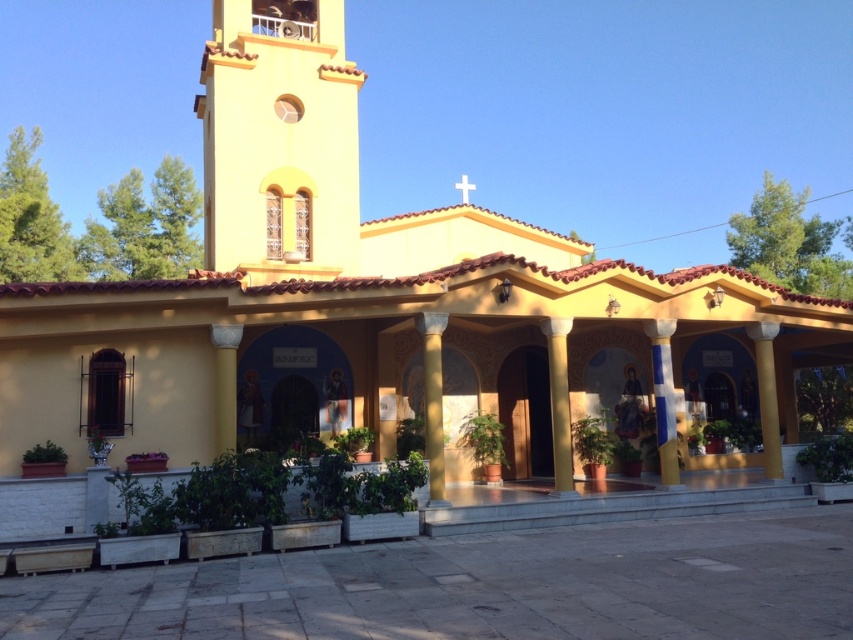
You are standing at the camera position and want to take a photo of the yellow stucco bell tower at upper left. If your camera has a maximum focus range of 14 meters, will it be able to capture the bell tower clearly?

The yellow stucco bell tower at upper left is 13.97 meters away from the camera, which is within the camera maximum focus range of 14 meters. Therefore, the camera can capture the bell tower clearly.

You are standing in front of the yellow church and want to take a photo that includes both the yellow stucco bell tower at upper left and the yellow matte column at center. Which object will appear larger in the photo?

The yellow stucco bell tower at upper left is taller than the yellow matte column at center, so it will appear larger in the photo.